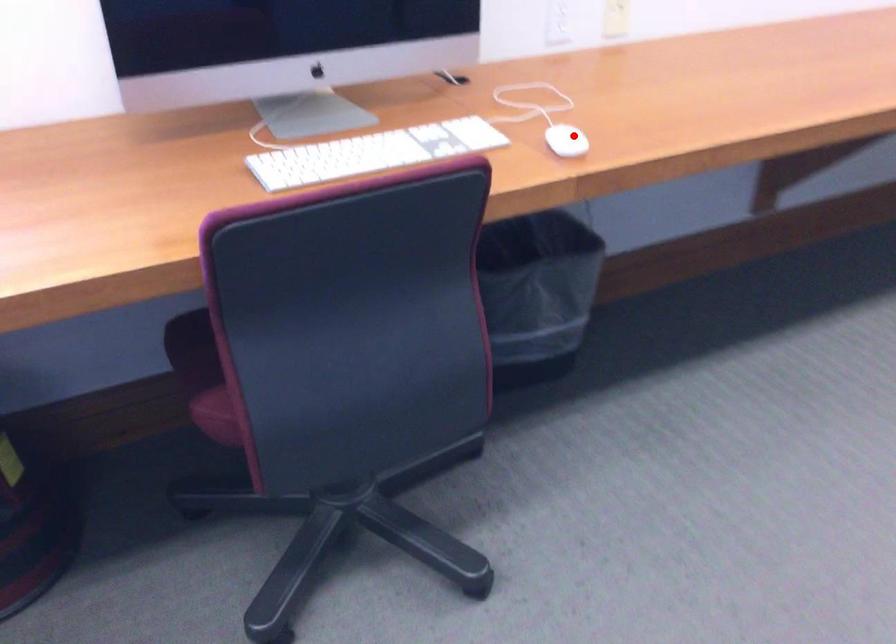
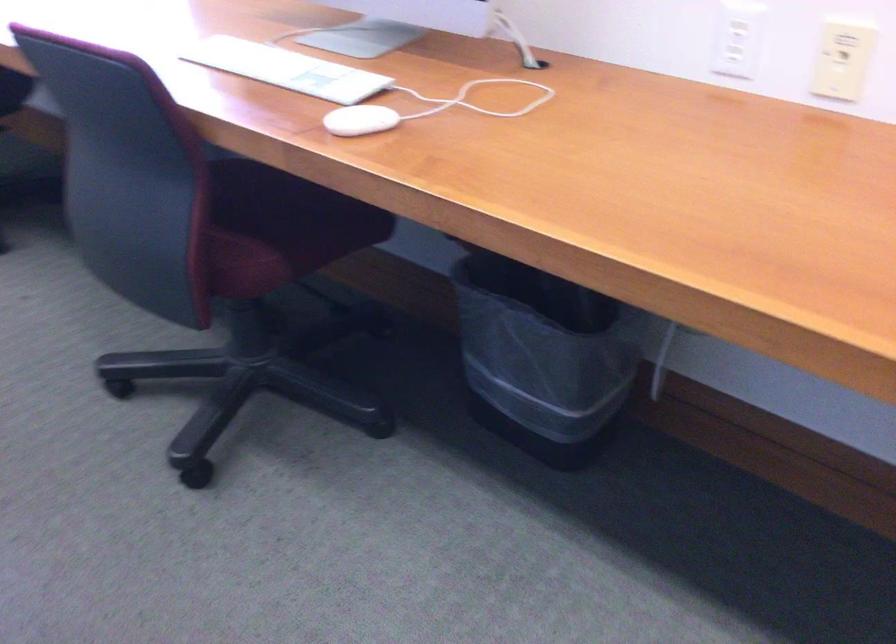
Question: I am providing you with two images of the same scene from different viewpoints. In image1, a red point is highlighted. Considering the same 3D point in image2, which of the following is correct?

Choices:
 (A) It is closer
 (B) It is farther

Answer: (A)